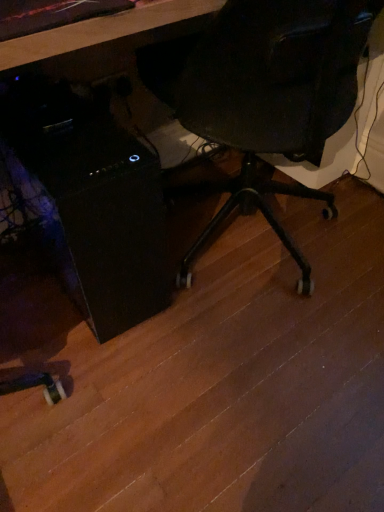
The width and height of the screenshot is (384, 512). I want to click on spots to the right of black matte computer tower at lower left, so click(x=223, y=279).